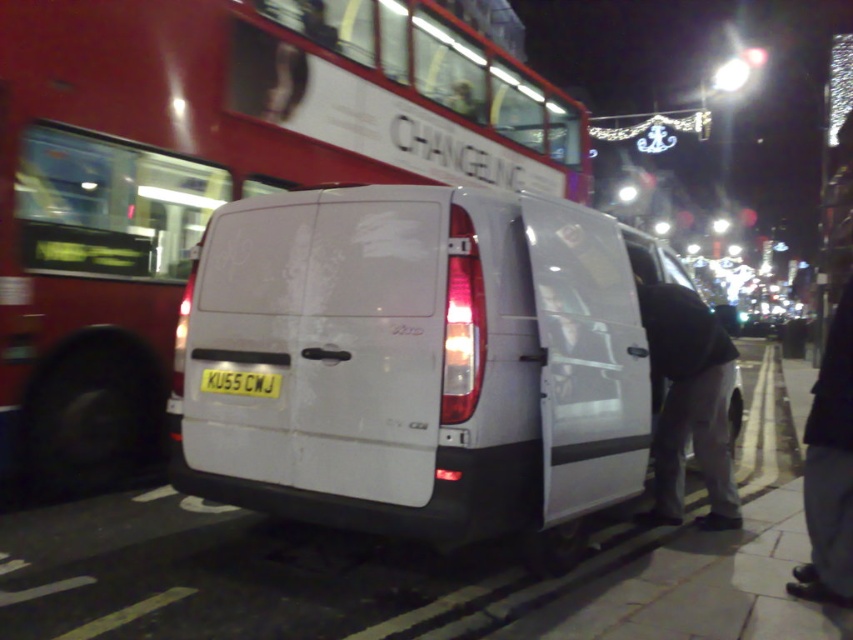
Is point (85, 67) positioned before point (225, 392)?

No, it is not.

Can you confirm if red metallic bus at upper center is smaller than yellow matte license plate at center?

Incorrect, red metallic bus at upper center is not smaller in size than yellow matte license plate at center.

Is point (339, 42) closer to viewer compared to point (228, 388)?

No, (339, 42) is further to viewer.

This screenshot has height=640, width=853. What are the coordinates of `red metallic bus at upper center` in the screenshot? It's located at (210, 176).

Is point (680, 497) positioned before point (840, 312)?

No.

Between point (695, 328) and point (834, 432), which one is positioned in front?

Positioned in front is point (834, 432).

Identify the location of dark gray pants at lower right. (689, 403).

Is point (830, 440) farther from viewer compared to point (254, 376)?

No, it is in front of (254, 376).

Which is behind, point (844, 305) or point (270, 394)?

Point (844, 305)

I want to click on black fabric pants at lower right, so click(x=828, y=468).